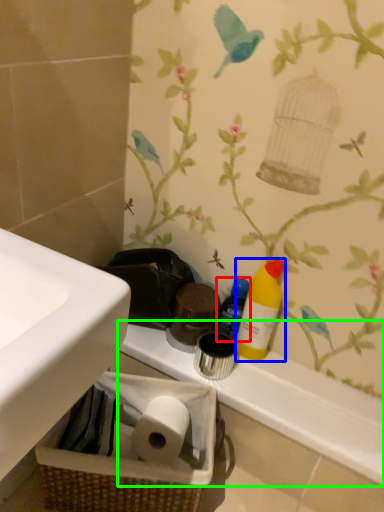
Question: Considering the real-world distances, which object is farthest from bottle (highlighted by a red box)? cleaning product (highlighted by a blue box) or counter top (highlighted by a green box)?

Choices:
 (A) cleaning product
 (B) counter top

Answer: (B)